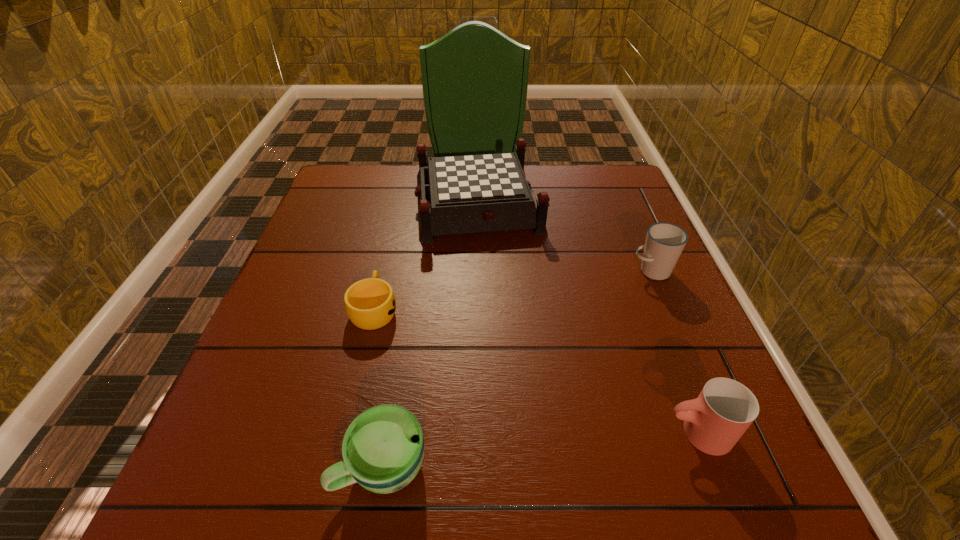
I want to click on the farthest object, so click(x=474, y=193).

This screenshot has height=540, width=960. What are the coordinates of `the fourth nearest object` in the screenshot? It's located at (665, 242).

I want to click on the third nearest cup, so click(x=370, y=303).

Locate an element on the screen. The width and height of the screenshot is (960, 540). the shortest object is located at coordinates (370, 303).

Locate an element on the screen. The image size is (960, 540). free location located 0.290m on the front of the farthest object is located at coordinates (477, 336).

This screenshot has width=960, height=540. What are the coordinates of `free space located with a handle on the side of the farthest cup` in the screenshot? It's located at (530, 271).

The height and width of the screenshot is (540, 960). I want to click on blank space located with a handle on the side of the farthest cup, so click(504, 271).

The width and height of the screenshot is (960, 540). Find the location of `free space located with a handle on the side of the farthest cup`. free space located with a handle on the side of the farthest cup is located at coordinates (574, 271).

The image size is (960, 540). I want to click on free spot located 0.150m on the front of the second farthest cup, so click(353, 401).

Find the location of a particular element. object positioned at the far edge is located at coordinates (474, 193).